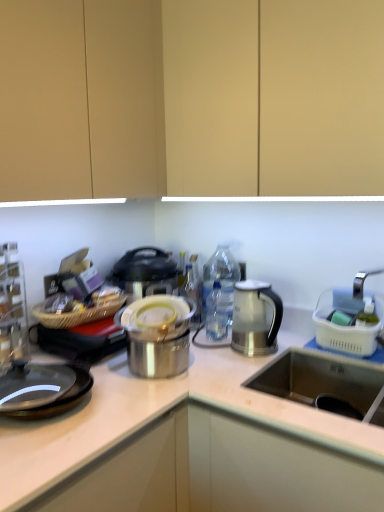
The height and width of the screenshot is (512, 384). Describe the element at coordinates (42, 390) in the screenshot. I see `black glass gas stove at left` at that location.

What do you see at coordinates (157, 336) in the screenshot? I see `shiny metallic pot at center, positioned as the 2th appliance in right-to-left order` at bounding box center [157, 336].

What do you see at coordinates (191, 447) in the screenshot? Image resolution: width=384 pixels, height=512 pixels. I see `matte silver pot at center` at bounding box center [191, 447].

The image size is (384, 512). Find the location of `matte wood cabinet at upper center`. matte wood cabinet at upper center is located at coordinates (191, 98).

This screenshot has width=384, height=512. Describe the element at coordinates (218, 312) in the screenshot. I see `clear plastic bottle at center` at that location.

Identify the location of black glass gas stove at left. The width and height of the screenshot is (384, 512). (42, 390).

Based on their positions, is white plastic basket at right, the first appliance positioned from the right, located to the left or right of black glass gas stove at left?

Clearly, white plastic basket at right, the first appliance positioned from the right, is on the right of black glass gas stove at left in the image.

Is white plastic basket at right, which appears as the 2th appliance when viewed from the left, with black glass gas stove at left?

No, white plastic basket at right, which appears as the 2th appliance when viewed from the left, is not beside black glass gas stove at left.

Is white plastic basket at right, which appears as the 2th appliance when viewed from the left, completely or partially outside of black glass gas stove at left?

Yes, white plastic basket at right, which appears as the 2th appliance when viewed from the left, is located beyond the bounds of black glass gas stove at left.

From a real-world perspective, is white plastic basket at right, the first appliance positioned from the right, physically below black glass gas stove at left?

Incorrect, from a real-world perspective, white plastic basket at right, the first appliance positioned from the right, is higher than black glass gas stove at left.

Measure the distance from clear plastic bottle at center to matte silver pot at center.

clear plastic bottle at center and matte silver pot at center are 21.95 inches apart from each other.

Which of these two, clear plastic bottle at center or matte silver pot at center, stands taller?

Standing taller between the two is matte silver pot at center.

Which is behind, point (221, 291) or point (273, 508)?

The point (221, 291) is farther from the camera.

Considering the relative sizes of clear plastic bottle at center and matte silver pot at center in the image provided, is clear plastic bottle at center wider than matte silver pot at center?

No, clear plastic bottle at center is not wider than matte silver pot at center.

Is matte wood cabinet at upper center completely or partially outside of matte silver pot at center?

matte wood cabinet at upper center lies outside matte silver pot at center's area.

Between matte wood cabinet at upper center and matte silver pot at center, which one has smaller size?

matte wood cabinet at upper center.

Could you tell me if matte wood cabinet at upper center is turned towards matte silver pot at center?

No.

Is matte wood cabinet at upper center far away from matte silver pot at center?

matte wood cabinet at upper center is actually quite close to matte silver pot at center.

Which of these two, matte silver pot at center or matte wood cabinet at upper center, is bigger?

matte silver pot at center is bigger.

Between matte silver pot at center and matte wood cabinet at upper center, which one has smaller width?

matte wood cabinet at upper center is thinner.

From a real-world perspective, who is located lower, matte silver pot at center or matte wood cabinet at upper center?

In real-world perspective, matte silver pot at center is lower.

Based on the photo, is the depth of matte silver pot at center less than that of matte wood cabinet at upper center?

Yes, the depth of matte silver pot at center is less than that of matte wood cabinet at upper center.

Which object is wider, matte wood cabinet at upper center or white plastic basket at right, the first appliance positioned from the right?

Wider between the two is matte wood cabinet at upper center.

Which is more to the left, matte wood cabinet at upper center or white plastic basket at right, which appears as the 2th appliance when viewed from the left?

matte wood cabinet at upper center is more to the left.

Is matte wood cabinet at upper center located outside white plastic basket at right, the first appliance positioned from the right?

Yes, matte wood cabinet at upper center is not within white plastic basket at right, the first appliance positioned from the right.

Considering the relative sizes of matte wood cabinet at upper center and white plastic basket at right, the first appliance positioned from the right, in the image provided, is matte wood cabinet at upper center taller than white plastic basket at right, the first appliance positioned from the right,?

Yes, matte wood cabinet at upper center is taller than white plastic basket at right, the first appliance positioned from the right.

From a real-world perspective, which object rests below the other?

shiny metallic pot at center, positioned as the 2th appliance in right-to-left order, is physically lower.

Is point (245, 344) closer or farther from the camera than point (122, 320)?

Point (245, 344).

Would you say shiny metallic pot at center, placed as the 1th appliance when sorted from left to right, is part of satin silver kettle at center's contents?

That's incorrect, shiny metallic pot at center, placed as the 1th appliance when sorted from left to right, is not inside satin silver kettle at center.

Is the position of satin silver kettle at center less distant than that of shiny metallic pot at center, positioned as the 2th appliance in right-to-left order?

No, it is behind shiny metallic pot at center, positioned as the 2th appliance in right-to-left order.

Which object is wider, white plastic basket at right, which appears as the 2th appliance when viewed from the left, or matte silver pot at center?

Wider between the two is matte silver pot at center.

Does white plastic basket at right, which appears as the 2th appliance when viewed from the left, have a smaller size compared to matte silver pot at center?

Yes.

Image resolution: width=384 pixels, height=512 pixels. Identify the location of appliance on the right of the matte silver pot at center. (349, 323).

Considering the points (345, 310) and (113, 388), which point is in front, point (345, 310) or point (113, 388)?

The point (113, 388) is closer.

From the image's perspective, which appliance is the 2nd one above the black glass gas stove at left? Please provide its 2D coordinates.

[(349, 323)]

This screenshot has width=384, height=512. I want to click on countertop directly beneath the clear plastic bottle at center (from a real-world perspective), so tap(191, 447).

When comparing their distances from white plastic basket at right, the first appliance positioned from the right, does satin silver kettle at center or clear plastic bottle at center seem closer?

satin silver kettle at center is closer to white plastic basket at right, the first appliance positioned from the right.

When comparing their distances from matte wood cabinet at upper center, does black glass gas stove at left or satin silver kettle at center seem closer?

Among the two, satin silver kettle at center is located nearer to matte wood cabinet at upper center.

When comparing their distances from clear plastic bottle at center, does matte wood cabinet at upper center or white plastic basket at right, the first appliance positioned from the right, seem closer?

→ white plastic basket at right, the first appliance positioned from the right, is positioned closer to the anchor clear plastic bottle at center.

Considering their positions, is matte silver pot at center positioned further to matte wood cabinet at upper center than satin silver kettle at center?

The object further to matte wood cabinet at upper center is matte silver pot at center.

Based on their spatial positions, is metallic glass shelf at left or satin silver kettle at center further from clear plastic bottle at center?

Based on the image, metallic glass shelf at left appears to be further to clear plastic bottle at center.

Looking at the image, which one is located further to black glass gas stove at left, white plastic basket at right, the first appliance positioned from the right, or matte wood cabinet at upper center?

Based on the image, white plastic basket at right, the first appliance positioned from the right, appears to be further to black glass gas stove at left.

Looking at the image, which one is located further to matte wood cabinet at upper center, shiny metallic pot at center, placed as the 1th appliance when sorted from left to right, or metallic glass shelf at left?

metallic glass shelf at left.

Which object lies further to the anchor point black glass gas stove at left, metallic glass shelf at left or white plastic basket at right, which appears as the 2th appliance when viewed from the left?

The object further to black glass gas stove at left is white plastic basket at right, which appears as the 2th appliance when viewed from the left.

You are a GUI agent. You are given a task and a screenshot of the screen. Output one action in this format:
    pyautogui.click(x=<x>, y=<y>)
    Task: Click on the appliance situated between metallic glass shelf at left and satin silver kettle at center from left to right
    The height and width of the screenshot is (512, 384).
    Given the screenshot: What is the action you would take?
    pyautogui.click(x=157, y=336)

Find the location of a particular element. This screenshot has height=512, width=384. gas stove between matte wood cabinet at upper center and matte silver pot at center in the vertical direction is located at coordinates (42, 390).

I want to click on appliance between metallic glass shelf at left and matte silver pot at center, so click(157, 336).

At what (x,y) coordinates should I click in order to perform the action: click on countertop located between black glass gas stove at left and satin silver kettle at center in the left-right direction. Please return your answer as a coordinate pair (x, y). The width and height of the screenshot is (384, 512). Looking at the image, I should click on (191, 447).